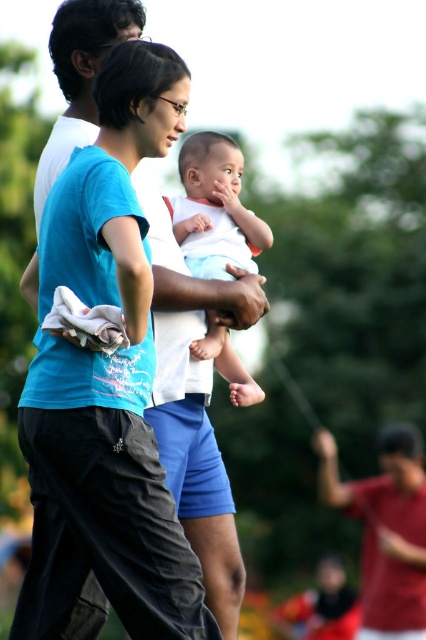
Question: Estimate the real-world distances between objects in this image. Which object is closer to the red shirt at center?

Choices:
 (A) white soft baby at center
 (B) blue cotton shirt at center

Answer: (A)

Question: Considering the relative positions of red shirt at center and white soft baby at center in the image provided, where is red shirt at center located with respect to white soft baby at center?

Choices:
 (A) below
 (B) above

Answer: (A)

Question: Is blue cotton shirt at center above red shirt at center?

Choices:
 (A) yes
 (B) no

Answer: (A)

Question: Considering the real-world distances, which object is closest to the red shirt at center?

Choices:
 (A) blue cotton shirt at center
 (B) white soft baby at center

Answer: (B)

Question: Does red shirt at center appear on the right side of white soft baby at center?

Choices:
 (A) yes
 (B) no

Answer: (A)

Question: Among these objects, which one is nearest to the camera?

Choices:
 (A) white soft baby at center
 (B) red shirt at center
 (C) blue cotton shirt at center

Answer: (C)